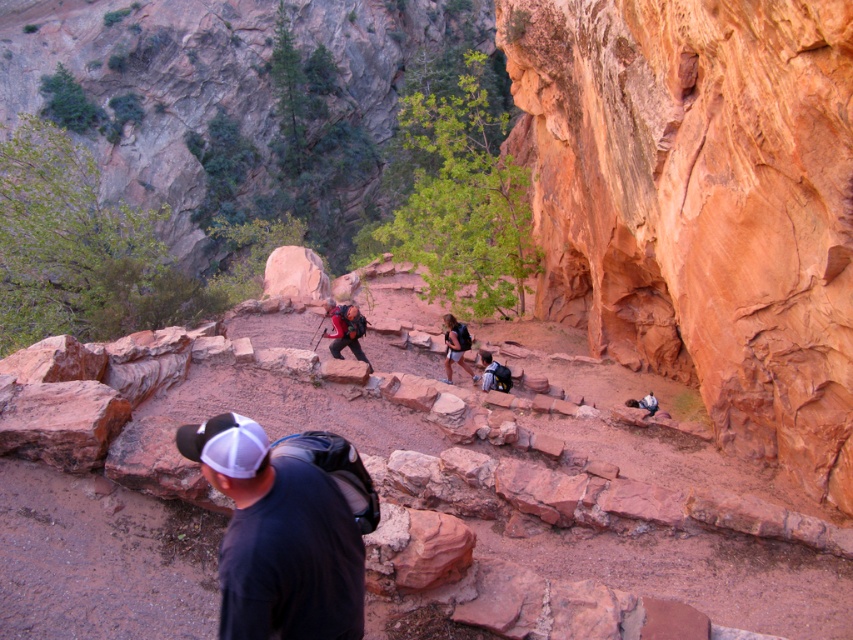
You are a hiker who wants to take a photo of the rustic sandstone cliff at right. The camera you have can only focus on objects within a 0.3 unit distance from the center of the frame. If you position the camera so that the center of the frame is at point (700,204), will the rustic sandstone cliff at right be in focus?

Yes, because the point (700,204) directly marks the rustic sandstone cliff at right, so positioning the camera there would place it within the 0.3 unit focus range.

In the scene shown: You are a hiker carrying a 10 kg backpack and want to place your backpack on the ground before continuing the hike. You see the black fabric backpack at lower center and the matte black backpack at center. Which backpack is farther away from you?

The matte black backpack at center is farther away because the black fabric backpack at lower center is only 10.70 meters away from it, meaning the matte black backpack at center is located 10.70 meters behind the black fabric backpack at lower center.

In the scene shown: You are a hiker trying to decide which backpack to take for your trip. You notice two backpacks in the scene. Which one has a larger width? The options are the black fabric backpack at lower center and the matte black backpack at center.

The black fabric backpack at lower center has a larger width than the matte black backpack at center.